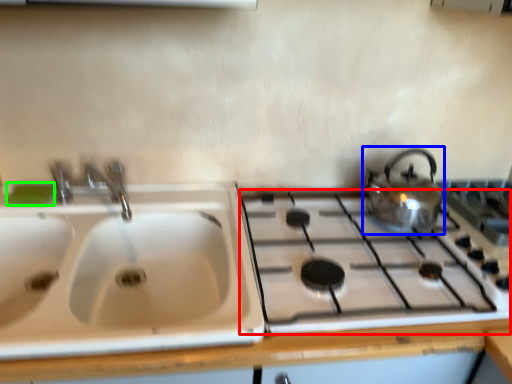
Question: Which object is the farthest from gas stove (highlighted by a red box)? Choose among these: kettle (highlighted by a blue box) or soap (highlighted by a green box).

Choices:
 (A) kettle
 (B) soap

Answer: (B)